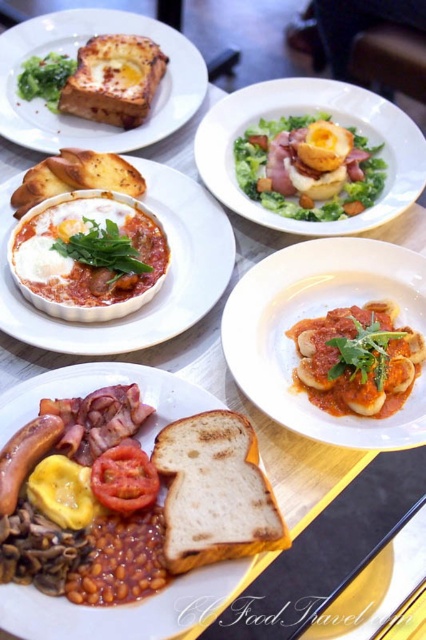
Question: Can you confirm if matte white plate at center is positioned to the left of smooth creamy dumplings at center?

Choices:
 (A) no
 (B) yes

Answer: (B)

Question: Estimate the real-world distances between objects in this image. Which object is farther from the white creamy sauce at center?

Choices:
 (A) red matte tomato at center
 (B) golden brown toasted bread at upper left
 (C) matte white plate at center
 (D) white ceramic bowl at upper center

Answer: (A)

Question: Which point is farther from the camera taking this photo?

Choices:
 (A) (26, 321)
 (B) (391, 278)
 (C) (106, 76)

Answer: (C)

Question: Does matte tomato sauce scallops at center have a larger size compared to golden brown toasted bread at upper left?

Choices:
 (A) no
 (B) yes

Answer: (B)

Question: Which point is closer to the camera?

Choices:
 (A) golden brown toasted bread at upper left
 (B) golden brown crusty bread at upper left

Answer: (B)

Question: Can you confirm if white ceramic bowl at upper center is smaller than golden brown crusty bread at upper left?

Choices:
 (A) no
 (B) yes

Answer: (A)